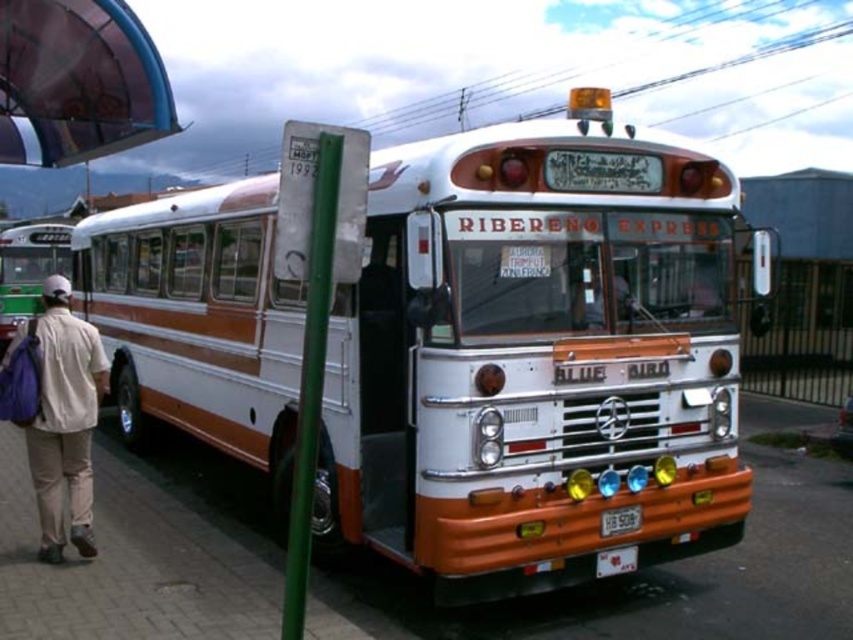
Question: Which of the following is the closest to the observer?

Choices:
 (A) light beige pants at lower left
 (B) matte orange bus at left

Answer: (A)

Question: Is green metallic pole at center positioned in front of matte orange bus at left?

Choices:
 (A) yes
 (B) no

Answer: (A)

Question: Which object is positioned closest to the light beige pants at lower left?

Choices:
 (A) brick pavement at lower left
 (B) green metallic pole at center
 (C) white/orange metal bus at center
 (D) white plastic license plate at center

Answer: (A)

Question: Which point appears farthest from the camera in this image?

Choices:
 (A) [71, 490]
 (B) [733, 628]
 (C) [624, 525]

Answer: (A)

Question: Considering the relative positions of white/orange metal bus at center and light beige pants at lower left in the image provided, where is white/orange metal bus at center located with respect to light beige pants at lower left?

Choices:
 (A) left
 (B) right

Answer: (B)

Question: Is the position of white/orange metal bus at center less distant than that of matte orange bus at left?

Choices:
 (A) yes
 (B) no

Answer: (A)